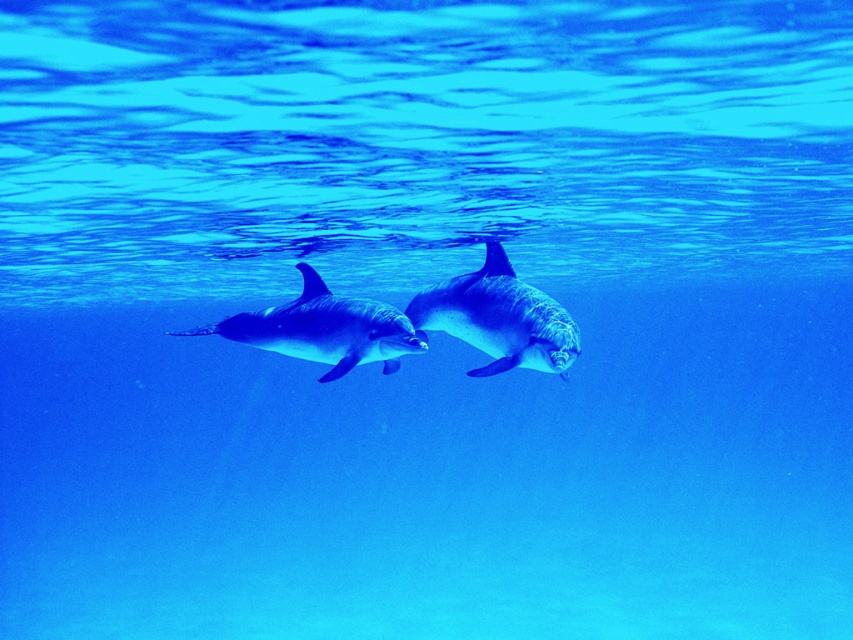
Who is more distant from viewer, (489, 352) or (343, 307)?

Positioned behind is point (343, 307).

This screenshot has height=640, width=853. Find the location of `glossy dolphin at center`. glossy dolphin at center is located at coordinates (498, 317).

The height and width of the screenshot is (640, 853). What are the coordinates of `glossy dolphin at center` in the screenshot? It's located at (498, 317).